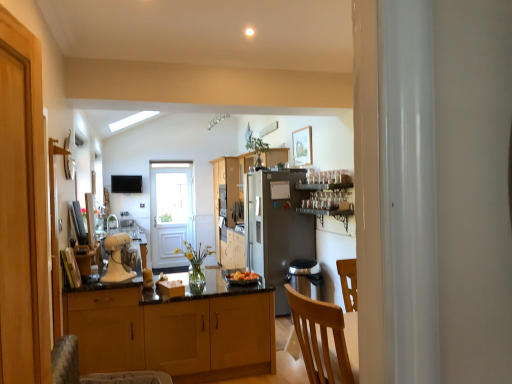
You are a GUI agent. You are given a task and a screenshot of the screen. Output one action in this format:
    pyautogui.click(x=<x>, y=<y>)
    Task: Click on the satin silver refrigerator at center
    The image size is (512, 384).
    Given the screenshot: What is the action you would take?
    pyautogui.click(x=276, y=228)

The image size is (512, 384). Describe the element at coordinates (126, 184) in the screenshot. I see `matte black tv at upper center` at that location.

Consider the image. How much space does green leafy plant at upper center, which is the 2th houseplant from bottom to top, occupy horizontally?

It is 16.47 inches.

This screenshot has width=512, height=384. What do you see at coordinates (257, 149) in the screenshot?
I see `green leafy plant at upper center, which is the 2th houseplant from bottom to top` at bounding box center [257, 149].

The height and width of the screenshot is (384, 512). Describe the element at coordinates (106, 329) in the screenshot. I see `matte white cabinet at center, which is the 1th cabinetry in front-to-back order` at that location.

How much space does wooden cabinet at center, positioned as the second cabinetry in back-to-front order, occupy vertically?

It is 73.26 centimeters.

Based on the photo, measure the distance between point [303,190] and camera.

Point [303,190] and camera are 5.39 meters apart.

Locate an element on the screen. The image size is (512, 384). satin silver refrigerator at center is located at coordinates (276, 228).

Does white matte stand mixer at center turn towards metallic glassware at center?

No, white matte stand mixer at center is not oriented towards metallic glassware at center.

Is white matte stand mixer at center situated inside metallic glassware at center or outside?

white matte stand mixer at center is located beyond the bounds of metallic glassware at center.

Can you confirm if white matte stand mixer at center is thinner than metallic glassware at center?

In fact, white matte stand mixer at center might be wider than metallic glassware at center.

Is white matte stand mixer at center shorter than metallic glassware at center?

Yes, white matte stand mixer at center is shorter than metallic glassware at center.

Which object is thinner, smooth orange fruit at center or matte white cabinet at center, which is the 1th cabinetry in front-to-back order?

Thinner between the two is smooth orange fruit at center.

Considering the positions of points (234, 278) and (113, 300), is point (234, 278) farther from camera compared to point (113, 300)?

That is True.

In the scene shown: Is smooth orange fruit at center directly adjacent to matte white cabinet at center, which is the 1th cabinetry in front-to-back order?

No, smooth orange fruit at center is not with matte white cabinet at center, which is the 1th cabinetry in front-to-back order.

Can you confirm if wooden door at left is shorter than satin silver refrigerator at center?

Yes, wooden door at left is shorter than satin silver refrigerator at center.

From a real-world perspective, is wooden door at left located higher than satin silver refrigerator at center?

Yes, from a real-world perspective, wooden door at left is over satin silver refrigerator at center

Would you consider wooden door at left to be distant from satin silver refrigerator at center?

Absolutely, wooden door at left is distant from satin silver refrigerator at center.

Is wooden door at left looking in the opposite direction of satin silver refrigerator at center?

No, wooden door at left is not facing the opposite direction of satin silver refrigerator at center.

Identify the location of cabinetry above the translucent glass vase at center, the 2th houseplant viewed from the back (from the image's perspective). Image resolution: width=512 pixels, height=384 pixels. (228, 211).

Is translucent glass vase at center, the 1th houseplant when ordered from bottom to top, to the left or to the right of wooden cabinets at center, the 3th cabinetry from the front, in the image?

In the image, translucent glass vase at center, the 1th houseplant when ordered from bottom to top, appears on the left side of wooden cabinets at center, the 3th cabinetry from the front.

From the image's perspective, which is above, translucent glass vase at center, the 1th houseplant positioned from the left, or wooden cabinets at center, the 3th cabinetry from the front?

From the image's view, wooden cabinets at center, the 3th cabinetry from the front, is above.

Is translucent glass vase at center, the 1th houseplant when ordered from bottom to top, bigger than wooden cabinets at center, the 3th cabinetry from the front?

Actually, translucent glass vase at center, the 1th houseplant when ordered from bottom to top, might be smaller than wooden cabinets at center, the 3th cabinetry from the front.

Is point (321, 199) farther from camera compared to point (49, 145)?

Yes, point (321, 199) is farther from viewer.

Does metallic glassware at center have a greater height compared to wooden door at left?

In fact, metallic glassware at center may be shorter than wooden door at left.

Where is `door located on the left of metallic glassware at center`? The width and height of the screenshot is (512, 384). door located on the left of metallic glassware at center is located at coordinates coord(55,241).

From the image's perspective, is metallic glassware at center beneath wooden door at left?

Incorrect, from the image's perspective, metallic glassware at center is higher than wooden door at left.

Does point (55, 154) lie behind point (192, 199)?

No, (55, 154) is in front of (192, 199).

From a real-world perspective, is wooden door at left positioned above or below white glossy door at center?

wooden door at left is situated higher than white glossy door at center in the real world.

From the image's perspective, who appears lower, wooden door at left or white glossy door at center?

white glossy door at center appears lower in the image.

Is wooden door at left looking in the opposite direction of white glossy door at center?

No, wooden door at left is not facing the opposite direction of white glossy door at center.

I want to click on screen door beneath the wooden framed picture at upper center (from a real-world perspective), so click(170, 211).

In the scene shown: Are white glossy door at center and wooden framed picture at upper center far apart?

Absolutely, white glossy door at center is distant from wooden framed picture at upper center.

Is white glossy door at center shorter than wooden framed picture at upper center?

Incorrect, the height of white glossy door at center does not fall short of that of wooden framed picture at upper center.

Considering the positions of objects white glossy door at center and wooden framed picture at upper center in the image provided, who is more to the left, white glossy door at center or wooden framed picture at upper center?

white glossy door at center.

The width and height of the screenshot is (512, 384). Identify the location of kitchen appliance that appears below the metallic glassware at center (from the image's perspective). (116, 258).

Find the location of a particular element. food above the matte white cabinet at center, the 3th cabinetry when ordered from back to front (from a real-world perspective) is located at coordinates (242, 277).

Considering their positions, is matte white cabinet at center, the 3th cabinetry when ordered from back to front, positioned closer to translucent glass vase at center, the first houseplant positioned from the front, than satin silver refrigerator at center?

satin silver refrigerator at center.

Which object lies further to the anchor point white glossy door at center, green leafy plant at upper center, the 1th houseplant when ordered from right to left, or matte white cabinet at center, the 3th cabinetry when ordered from back to front?

The object further to white glossy door at center is matte white cabinet at center, the 3th cabinetry when ordered from back to front.

Looking at the image, which one is located closer to matte black tv at upper center, smooth orange fruit at center or metallic glassware at center?

metallic glassware at center lies closer to matte black tv at upper center than the other object.

Based on their spatial positions, is metallic glassware at center or wooden cabinets at center, marked as the first cabinetry in a back-to-front arrangement, closer to matte black tv at upper center?

Based on the image, wooden cabinets at center, marked as the first cabinetry in a back-to-front arrangement, appears to be nearer to matte black tv at upper center.

Based on their spatial positions, is green leafy plant at upper center, marked as the first houseplant in a top-to-bottom arrangement, or translucent glass vase at center, the 1th houseplant positioned from the left, further from matte black tv at upper center?

green leafy plant at upper center, marked as the first houseplant in a top-to-bottom arrangement, is positioned further to the anchor matte black tv at upper center.

When comparing their distances from matte black tv at upper center, does wooden door at left or translucent glass vase at center, placed as the second houseplant when sorted from right to left, seem further?

wooden door at left lies further to matte black tv at upper center than the other object.

From the image, which object appears to be farther from green leafy plant at upper center, positioned as the second houseplant in front-to-back order, wooden door at left or smooth orange fruit at center?

Based on the image, wooden door at left appears to be further to green leafy plant at upper center, positioned as the second houseplant in front-to-back order.

When comparing their distances from wooden framed picture at upper center, does wooden cabinet at center, arranged as the second cabinetry when viewed from the front, or satin silver refrigerator at center seem closer?

satin silver refrigerator at center.

Locate an element on the screen. The image size is (512, 384). picture frame positioned between wooden cabinet at center, positioned as the second cabinetry in back-to-front order, and green leafy plant at upper center, positioned as the second houseplant in front-to-back order, from near to far is located at coordinates point(302,146).

Locate an element on the screen. The width and height of the screenshot is (512, 384). houseplant positioned between wooden door at left and green leafy plant at upper center, arranged as the 2th houseplant when viewed from the left, from near to far is located at coordinates (195, 262).

Image resolution: width=512 pixels, height=384 pixels. Identify the location of refrigerator located between metallic glassware at center and white glossy door at center in the depth direction. (x=276, y=228).

Where is `door between matte white cabinet at center, which is the 1th cabinetry in front-to-back order, and wooden cabinet at center, arranged as the second cabinetry when viewed from the front, in the horizontal direction`? The image size is (512, 384). door between matte white cabinet at center, which is the 1th cabinetry in front-to-back order, and wooden cabinet at center, arranged as the second cabinetry when viewed from the front, in the horizontal direction is located at coordinates point(55,241).